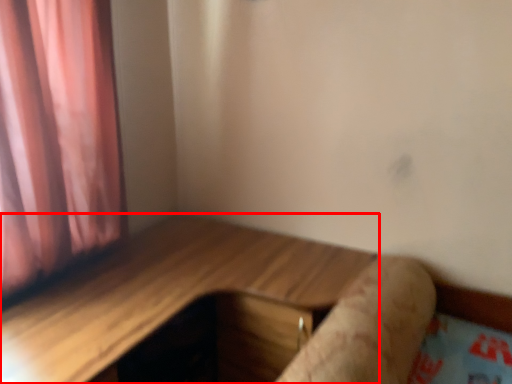
Question: From the image's perspective, where is table (annotated by the red box) located in relation to log in the image?

Choices:
 (A) above
 (B) below

Answer: (B)